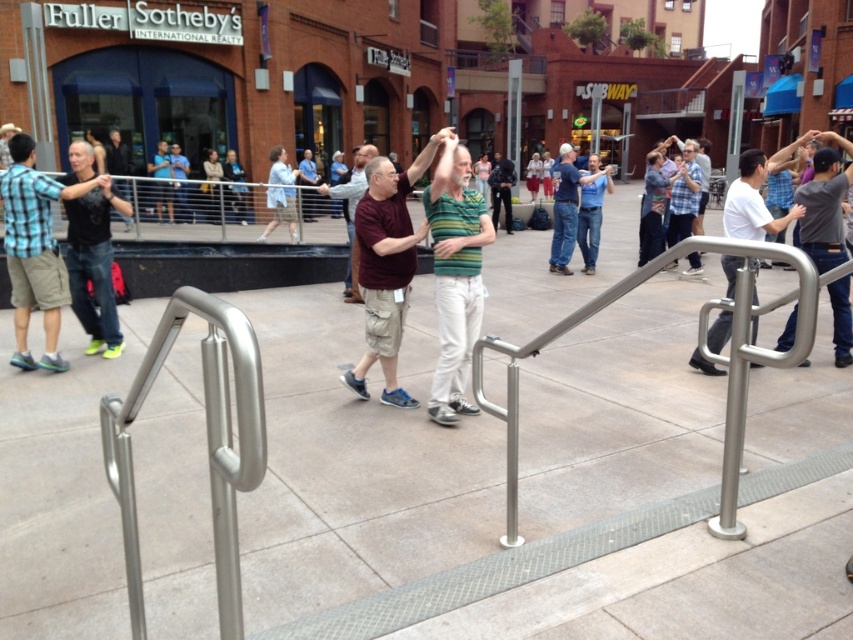
You are a photographer planning to capture a group photo of the matte black shirt at left and the white matte shirt at right. Since you want both shirts to appear the same size in the photo, which person should you move closer to the camera?

The matte black shirt at left is wider than the white matte shirt at right, so to make them appear the same size in the photo, you should move the matte black shirt at left closer to the camera.

You are standing at the handrail in the foreground of the plaza. You see two points marked in the scene. Which point is closer to you, point (450, 348) or point (683, 269)?

Point (450, 348) is in front of point (683, 269), so it is closer to you.

You are a photographer standing in the public square and want to take a photo of the matte black shirt at left and the white matte shirt at right. Which person should you focus on first if you want to capture both in the frame without moving the camera?

You should focus on the matte black shirt at left first because it is much taller than the white matte shirt at right, so it will be easier to include both in the frame by starting with the taller individual.